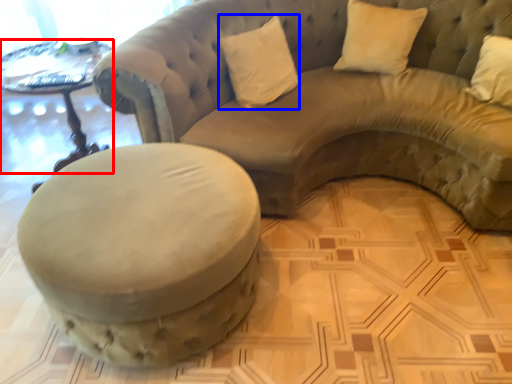
Question: Among these objects, which one is nearest to the camera, table (highlighted by a red box) or pillow (highlighted by a blue box)?

Choices:
 (A) table
 (B) pillow

Answer: (A)